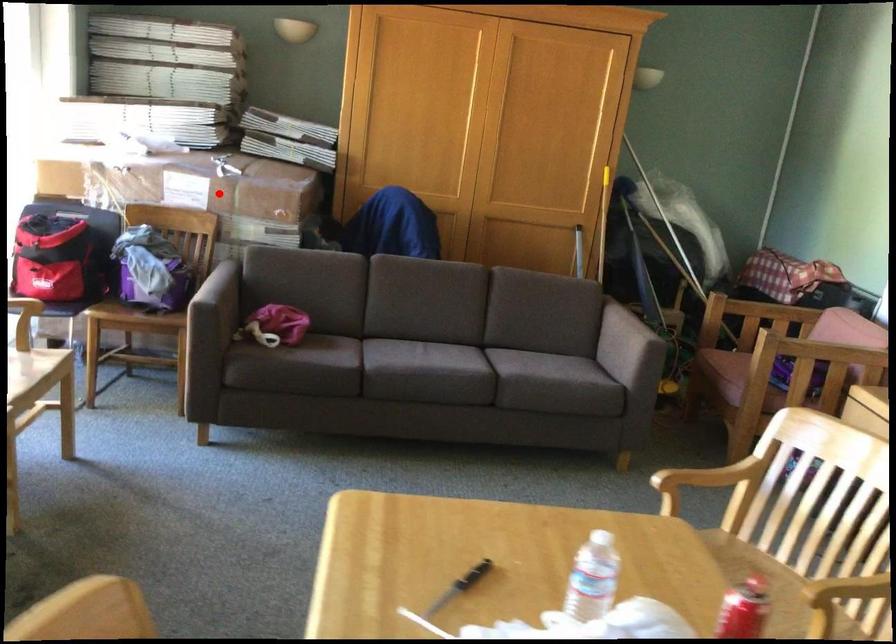
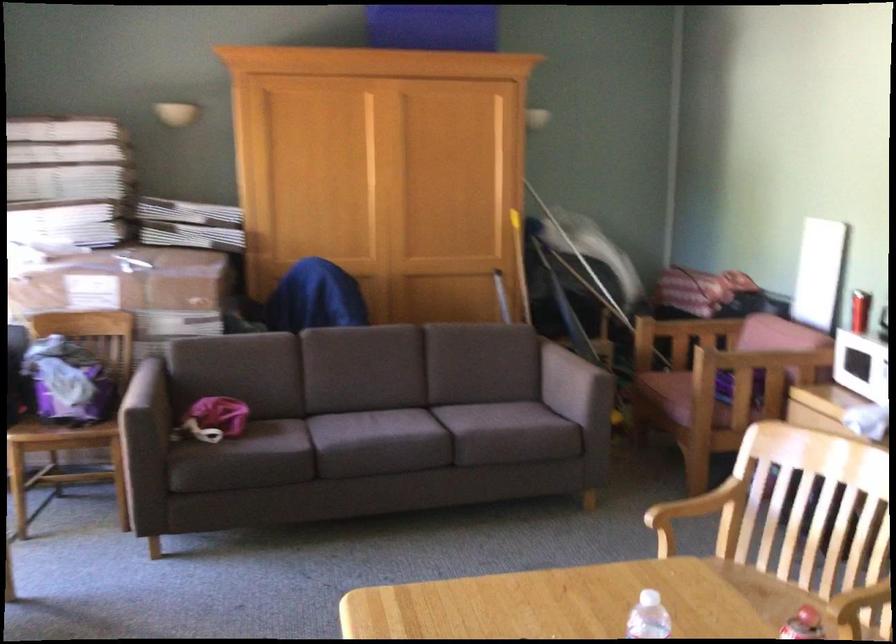
Where in the second image is the point corresponding to the highlighted location from the first image?

(131, 290)